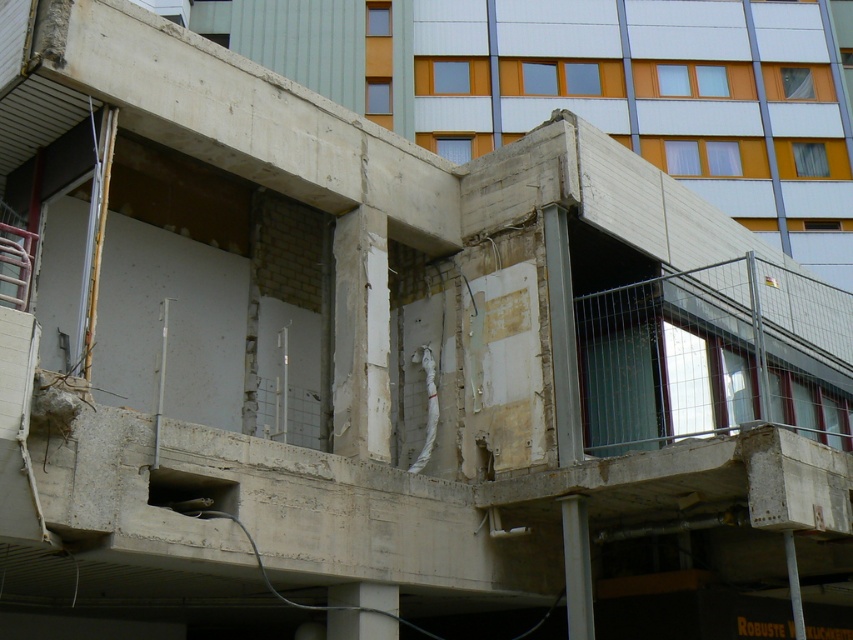
Question: Can you confirm if concrete at lower center is smaller than concrete pillar at lower right?

Choices:
 (A) yes
 (B) no

Answer: (B)

Question: Does white concrete pillar at lower right appear on the right side of concrete pillar at lower right?

Choices:
 (A) yes
 (B) no

Answer: (B)

Question: Among these objects, which one is nearest to the camera?

Choices:
 (A) white concrete pillar at lower right
 (B) concrete at lower center

Answer: (B)

Question: Which object appears farthest from the camera in this image?

Choices:
 (A) concrete pillar at lower right
 (B) white concrete pillar at lower right

Answer: (B)

Question: Which object is closer to the camera taking this photo?

Choices:
 (A) concrete at lower center
 (B) white concrete pillar at lower right
 (C) concrete pillar at lower right

Answer: (C)

Question: Is white concrete pillar at lower right below concrete at lower center?

Choices:
 (A) no
 (B) yes

Answer: (A)